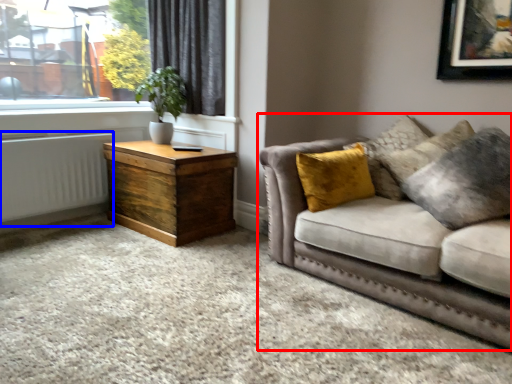
Question: Which object appears farthest to the camera in this image, studio couch (highlighted by a red box) or radiator (highlighted by a blue box)?

Choices:
 (A) studio couch
 (B) radiator

Answer: (B)